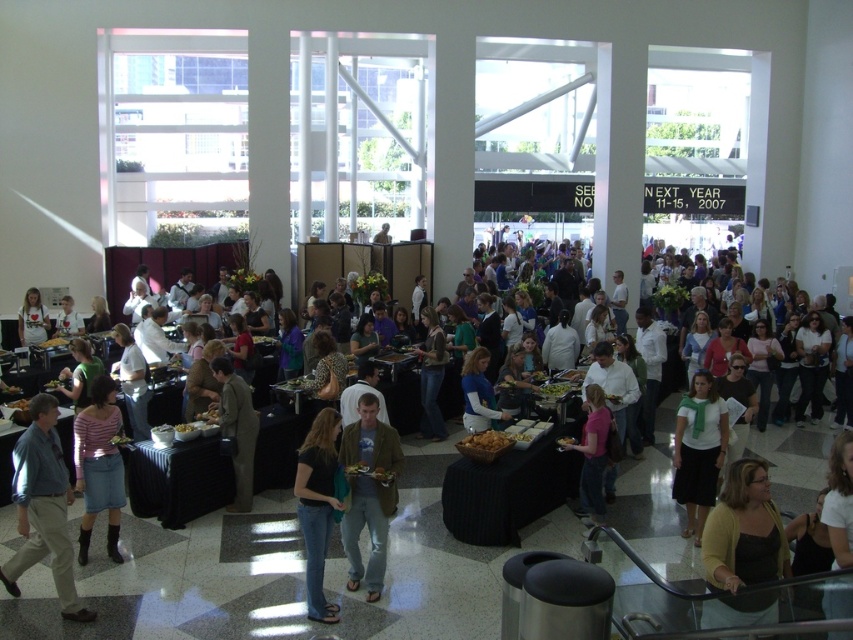
Does pink fabric shirt at center appear on the right side of golden crispy bread at center?

Yes, pink fabric shirt at center is to the right of golden crispy bread at center.

The image size is (853, 640). I want to click on pink fabric shirt at center, so click(593, 456).

Locate an element on the screen. This screenshot has height=640, width=853. pink fabric shirt at center is located at coordinates (593, 456).

At what (x,y) coordinates should I click in order to perform the action: click on pink fabric shirt at center. Please return your answer as a coordinate pair (x, y). The width and height of the screenshot is (853, 640). Looking at the image, I should click on (593, 456).

Describe the element at coordinates (744, 531) in the screenshot. I see `matte yellow cardigan at lower right` at that location.

Can you confirm if matte yellow cardigan at lower right is positioned below khaki pants at lower left?

Correct, matte yellow cardigan at lower right is located below khaki pants at lower left.

Does point (724, 580) come in front of point (16, 440)?

Yes, point (724, 580) is in front of point (16, 440).

This screenshot has height=640, width=853. I want to click on matte yellow cardigan at lower right, so click(x=744, y=531).

Who is more forward, (476, 376) or (65, 307)?

Point (476, 376) is more forward.

What do you see at coordinates (479, 394) in the screenshot? The height and width of the screenshot is (640, 853). I see `matte blue shirt at center` at bounding box center [479, 394].

At what (x,y) coordinates should I click in order to perform the action: click on matte blue shirt at center. Please return your answer as a coordinate pair (x, y). The image size is (853, 640). Looking at the image, I should click on (479, 394).